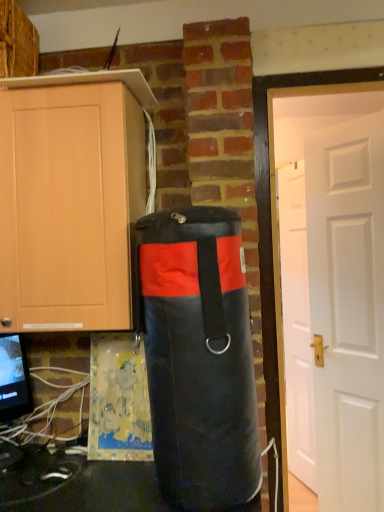
In order to face white matte door at right, acting as the 2th door starting from the front, should I rotate leftwards or rightwards?

You should rotate right by 13.827 degrees.

The height and width of the screenshot is (512, 384). Describe the element at coordinates (296, 323) in the screenshot. I see `white matte door at right, acting as the 2th door starting from the front` at that location.

Locate an element on the screen. The image size is (384, 512). matte black monitor at lower left is located at coordinates (14, 378).

Describe the element at coordinates (70, 198) in the screenshot. I see `matte wood cabinet at left` at that location.

I want to click on white matte door at right, the first door when ordered from back to front, so click(296, 323).

Can you confirm if white matte door at right, the second door viewed from the back, is wider than matte black monitor at lower left?

Incorrect, the width of white matte door at right, the second door viewed from the back, does not surpass that of matte black monitor at lower left.

Find the location of a particular element. The image size is (384, 512). computer monitor lying on the left of white matte door at right, the second door viewed from the back is located at coordinates (14, 378).

Based on the photo, how many degrees apart are the facing directions of white matte door at right, the second door viewed from the back, and matte black monitor at lower left?

They differ by 98 degrees in their facing directions.

From the image's perspective, is white matte door at right, the second door viewed from the back, on matte black monitor at lower left?

Yes, from the image's perspective, white matte door at right, the second door viewed from the back, is above matte black monitor at lower left.

In the scene shown: Can matte black monitor at lower left be found inside matte wood cabinet at left?

Actually, matte black monitor at lower left is outside matte wood cabinet at left.

Based on the photo, which of these two, matte wood cabinet at left or matte black monitor at lower left, stands shorter?

Standing shorter between the two is matte black monitor at lower left.

Considering the relative positions of matte wood cabinet at left and matte black monitor at lower left in the image provided, is matte wood cabinet at left to the right of matte black monitor at lower left from the viewer's perspective?

Yes.

From the image's perspective, between black fabric punching bag at center and white matte door at right, the first door when ordered from back to front, who is located below?

white matte door at right, the first door when ordered from back to front.

In the scene shown: Is black fabric punching bag at center at the right side of white matte door at right, the first door when ordered from back to front?

No.

Are black fabric punching bag at center and white matte door at right, the first door when ordered from back to front, beside each other?

No, black fabric punching bag at center is not next to white matte door at right, the first door when ordered from back to front.

From a real-world perspective, which object stands above the other?

In real-world perspective, black fabric punching bag at center is above.

Considering the sizes of objects black fabric punching bag at center and white matte door at right, the 1th door when ordered from front to back, in the image provided, who is thinner, black fabric punching bag at center or white matte door at right, the 1th door when ordered from front to back,?

white matte door at right, the 1th door when ordered from front to back.

Is black fabric punching bag at center facing towards white matte door at right, the 1th door when ordered from front to back?

No.

Is there a large distance between black fabric punching bag at center and white matte door at right, the second door viewed from the back?

black fabric punching bag at center is far away from white matte door at right, the second door viewed from the back.

Which object is wider, matte wood cabinet at left or black fabric punching bag at center?

Wider between the two is matte wood cabinet at left.

Which of these two, matte wood cabinet at left or black fabric punching bag at center, stands shorter?

matte wood cabinet at left is shorter.

Considering the relative positions of matte wood cabinet at left and black fabric punching bag at center in the image provided, is matte wood cabinet at left to the right of black fabric punching bag at center from the viewer's perspective?

In fact, matte wood cabinet at left is to the left of black fabric punching bag at center.

From a real-world perspective, does matte wood cabinet at left sit lower than black fabric punching bag at center?

No, from a real-world perspective, matte wood cabinet at left is not below black fabric punching bag at center.

Consider the image. Would you say black fabric punching bag at center is part of white matte door at right, acting as the 2th door starting from the front,'s contents?

No.

From a real-world perspective, is white matte door at right, acting as the 2th door starting from the front, positioned above or below black fabric punching bag at center?

In terms of real-world spatial position, white matte door at right, acting as the 2th door starting from the front, is below black fabric punching bag at center.

In the scene shown: Considering the sizes of objects white matte door at right, acting as the 2th door starting from the front, and black fabric punching bag at center in the image provided, who is smaller, white matte door at right, acting as the 2th door starting from the front, or black fabric punching bag at center?

With smaller size is white matte door at right, acting as the 2th door starting from the front.

This screenshot has height=512, width=384. Identify the location of punching bag on the left of white matte door at right, acting as the 2th door starting from the front. (198, 357).

Considering the positions of objects black fabric punching bag at center and matte black monitor at lower left in the image provided, who is more to the right, black fabric punching bag at center or matte black monitor at lower left?

black fabric punching bag at center is more to the right.

Is black fabric punching bag at center facing away from matte black monitor at lower left?

black fabric punching bag at center is not turned away from matte black monitor at lower left.

The height and width of the screenshot is (512, 384). Find the location of `computer monitor below the white matte door at right, the 1th door when ordered from front to back (from the image's perspective)`. computer monitor below the white matte door at right, the 1th door when ordered from front to back (from the image's perspective) is located at coordinates (14, 378).

At what (x,y) coordinates should I click in order to perform the action: click on cabinetry located above the matte black monitor at lower left (from the image's perspective). Please return your answer as a coordinate pair (x, y). Looking at the image, I should click on (70, 198).

Estimate the real-world distances between objects in this image. Which object is closer to white matte door at right, the 1th door when ordered from front to back, white matte door at right, the first door when ordered from back to front, or matte black monitor at lower left?

white matte door at right, the first door when ordered from back to front.

Considering their positions, is matte wood cabinet at left positioned closer to white matte door at right, the 1th door when ordered from front to back, than white matte door at right, the first door when ordered from back to front?

white matte door at right, the first door when ordered from back to front.

Which object lies further to the anchor point white matte door at right, the first door when ordered from back to front, matte black monitor at lower left or matte wood cabinet at left?

matte wood cabinet at left is positioned further to the anchor white matte door at right, the first door when ordered from back to front.

Based on their spatial positions, is white matte door at right, acting as the 2th door starting from the front, or matte black monitor at lower left further from black fabric punching bag at center?

Among the two, white matte door at right, acting as the 2th door starting from the front, is located further to black fabric punching bag at center.

From the picture: When comparing their distances from matte wood cabinet at left, does black fabric punching bag at center or matte black monitor at lower left seem closer?

The object closer to matte wood cabinet at left is black fabric punching bag at center.

Based on their spatial positions, is white matte door at right, the 1th door when ordered from front to back, or white matte door at right, acting as the 2th door starting from the front, further from matte wood cabinet at left?

The object further to matte wood cabinet at left is white matte door at right, acting as the 2th door starting from the front.

Which object lies nearer to the anchor point white matte door at right, the first door when ordered from back to front, matte wood cabinet at left or black fabric punching bag at center?

black fabric punching bag at center lies closer to white matte door at right, the first door when ordered from back to front, than the other object.

Considering their positions, is white matte door at right, the first door when ordered from back to front, positioned closer to white matte door at right, the 1th door when ordered from front to back, than matte wood cabinet at left?

white matte door at right, the first door when ordered from back to front.

The width and height of the screenshot is (384, 512). I want to click on door between black fabric punching bag at center and white matte door at right, acting as the 2th door starting from the front, along the z-axis, so click(348, 309).

Locate an element on the screen. cabinetry situated between matte black monitor at lower left and black fabric punching bag at center from left to right is located at coordinates (70, 198).

You are a GUI agent. You are given a task and a screenshot of the screen. Output one action in this format:
    pyautogui.click(x=<x>, y=<y>)
    Task: Click on the computer monitor between matte wood cabinet at left and white matte door at right, acting as the 2th door starting from the front, in the front-back direction
    Image resolution: width=384 pixels, height=512 pixels.
    Given the screenshot: What is the action you would take?
    pyautogui.click(x=14, y=378)

You are a GUI agent. You are given a task and a screenshot of the screen. Output one action in this format:
    pyautogui.click(x=<x>, y=<y>)
    Task: Click on the cabinetry between black fabric punching bag at center and white matte door at right, acting as the 2th door starting from the front, in the front-back direction
    
    Given the screenshot: What is the action you would take?
    pos(70,198)